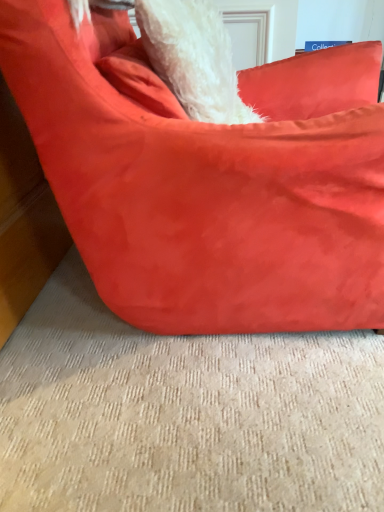
This screenshot has height=512, width=384. I want to click on suede-like red bean bag at center, so click(x=207, y=180).

This screenshot has height=512, width=384. Describe the element at coordinates (207, 180) in the screenshot. I see `suede-like red bean bag at center` at that location.

Where is `suede-like red bean bag at center`? Image resolution: width=384 pixels, height=512 pixels. suede-like red bean bag at center is located at coordinates (207, 180).